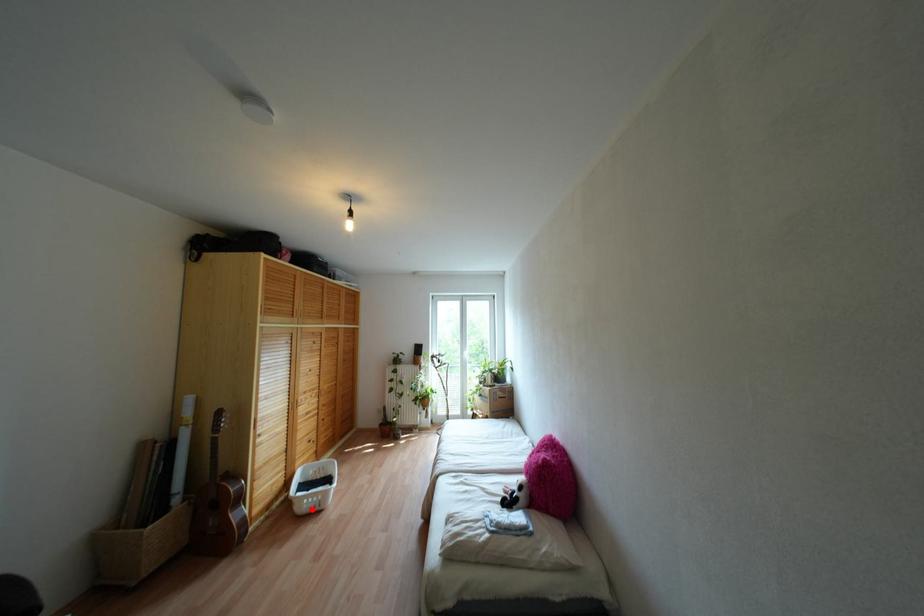
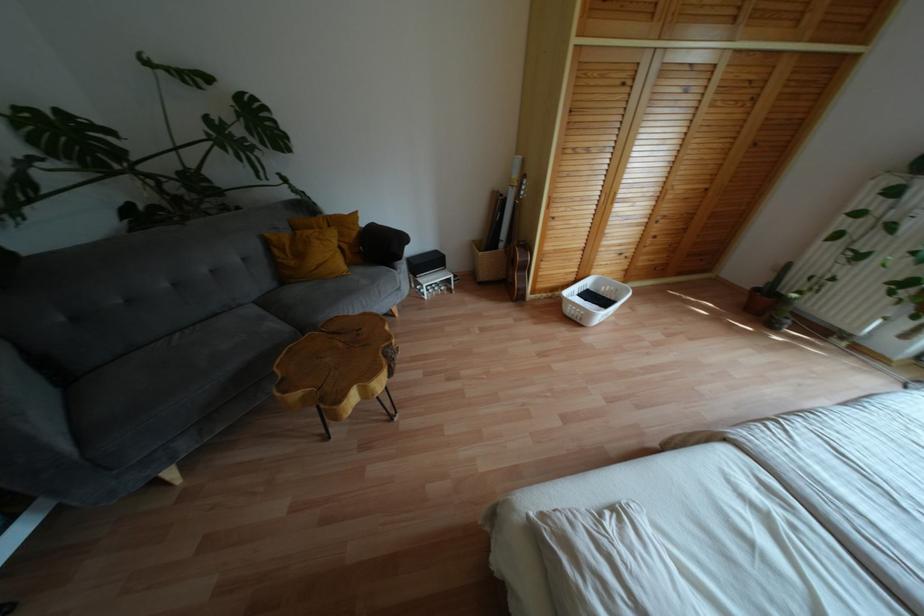
In the second image, find the point that corresponds to the highlighted location in the first image.

(573, 318)